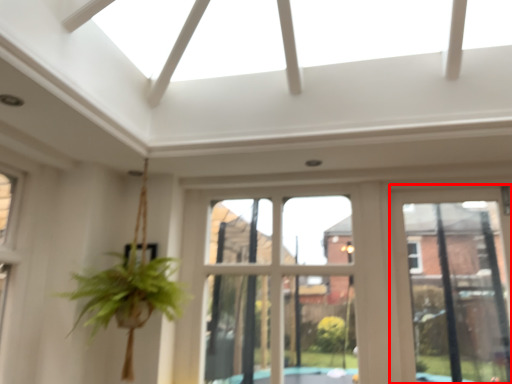
Question: In this image, where is window frame (annotated by the red box) located relative to bay window?

Choices:
 (A) right
 (B) left

Answer: (A)